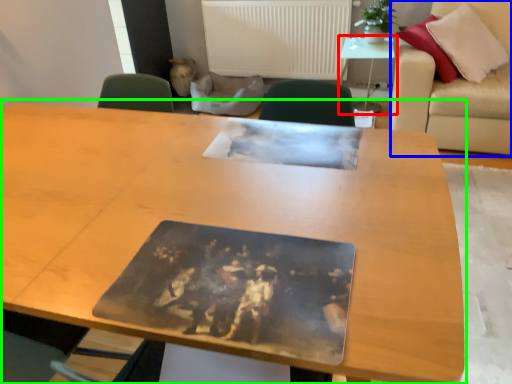
Question: Which object is the farthest from table (highlighted by a red box)? Choose among these: couch (highlighted by a blue box) or table (highlighted by a green box).

Choices:
 (A) couch
 (B) table

Answer: (B)